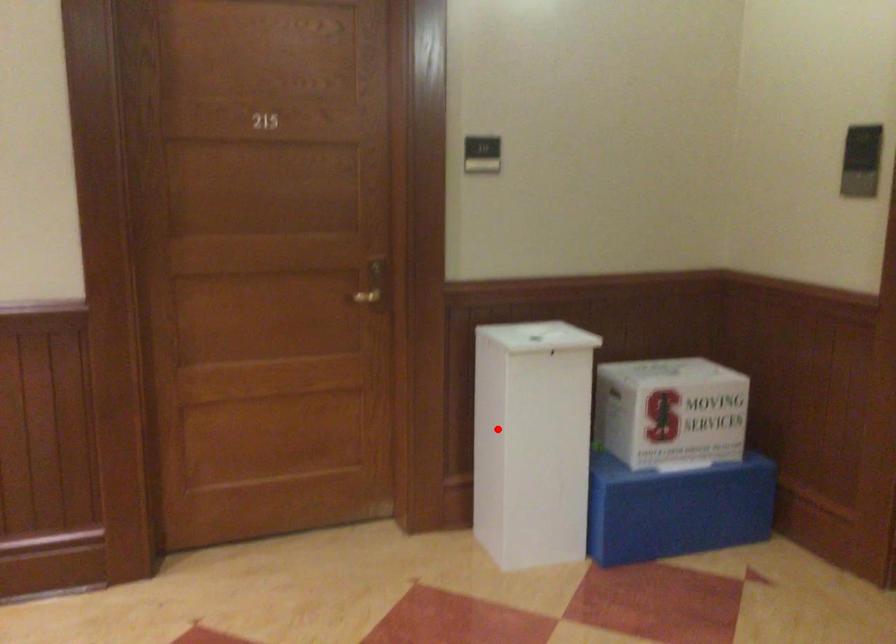
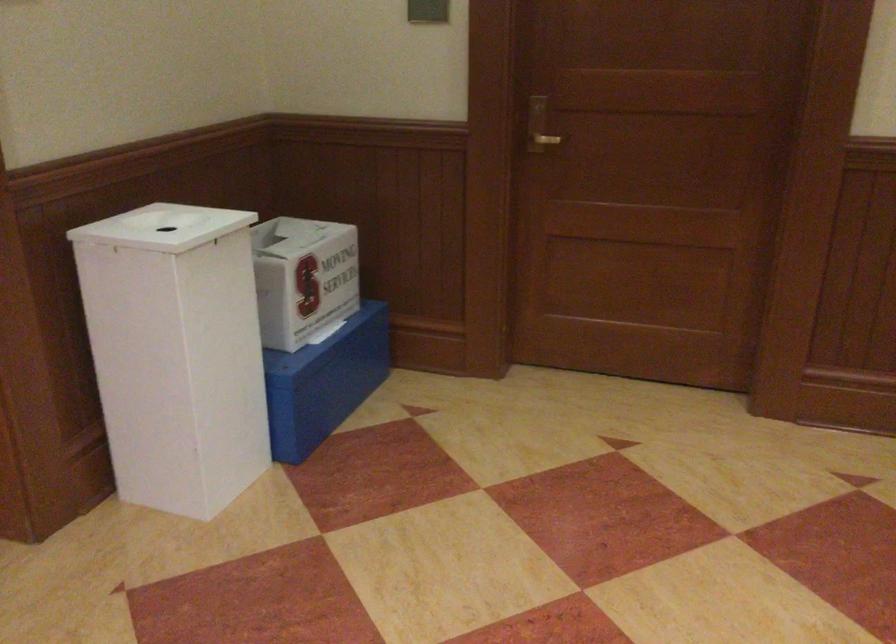
Question: I am providing you with two images of the same scene from different viewpoints. A red point is marked on the first image. At the location where the point appears in image 1, is it still visible in image 2?

Choices:
 (A) Yes
 (B) No

Answer: (A)